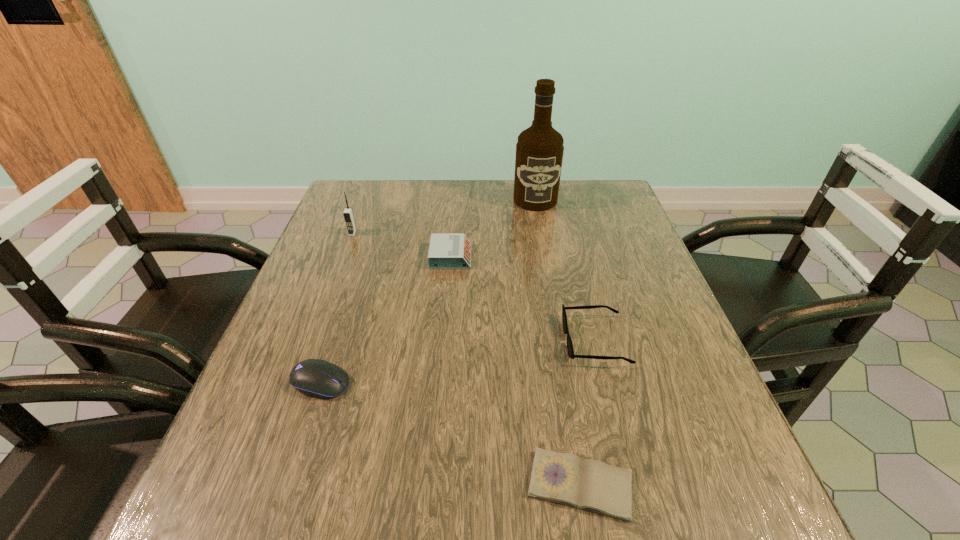
Point out which object is positioned as the third nearest to the third object from left to right. Please provide its 2D coordinates. Your answer should be formatted as a tuple, i.e. [(x, y)], where the tuple contains the x and y coordinates of a point satisfying the conditions above.

[(570, 350)]

You are a GUI agent. You are given a task and a screenshot of the screen. Output one action in this format:
    pyautogui.click(x=<x>, y=<y>)
    Task: Click on the vacant position in the image that satisfies the following two spatial constraints: 1. on the front-facing side of the cellular telephone; 2. on the left side of the computer mouse
    The height and width of the screenshot is (540, 960).
    Given the screenshot: What is the action you would take?
    pyautogui.click(x=297, y=382)